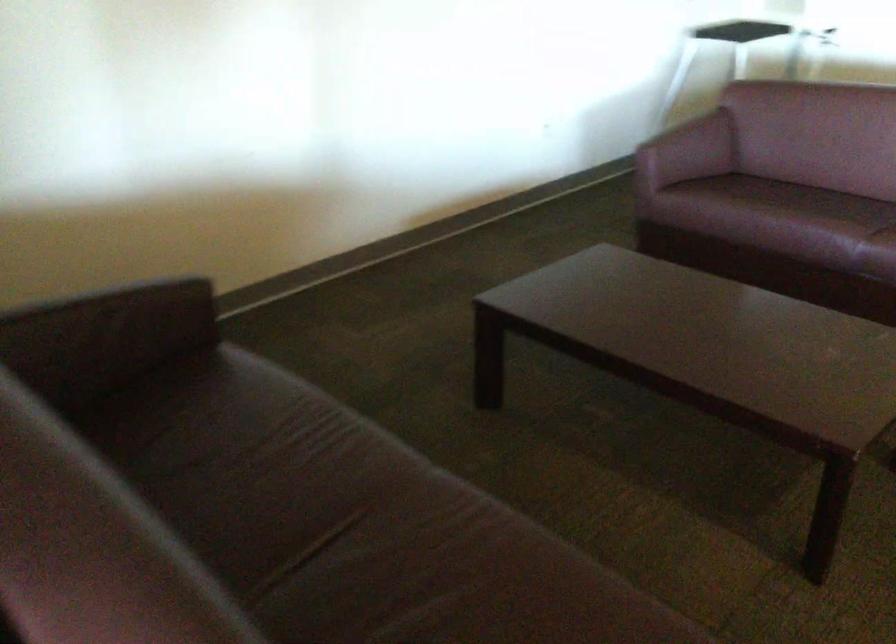
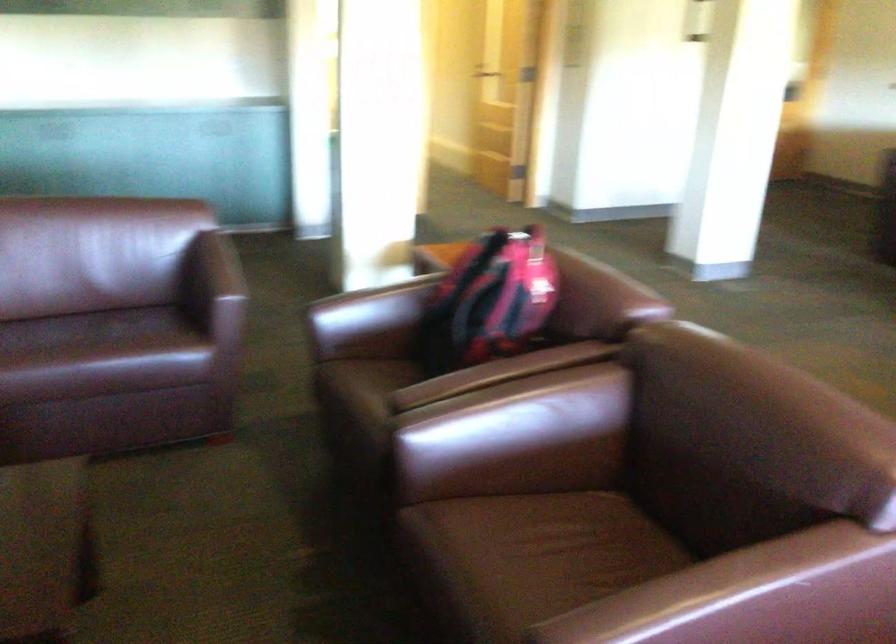
How did the camera likely rotate?

The camera's rotation is toward right-down.